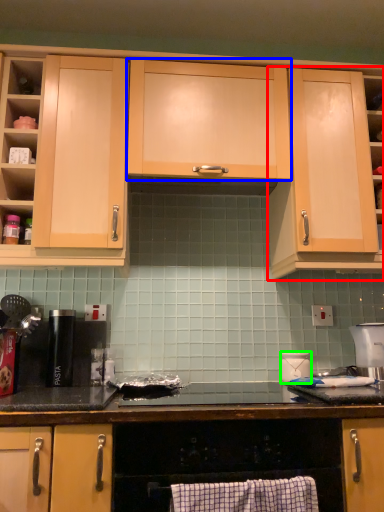
Question: Which object is positioned farthest from cabinetry (highlighted by a red box)? Select from cabinetry (highlighted by a blue box) and kitchen appliance (highlighted by a green box).

Choices:
 (A) cabinetry
 (B) kitchen appliance

Answer: (B)